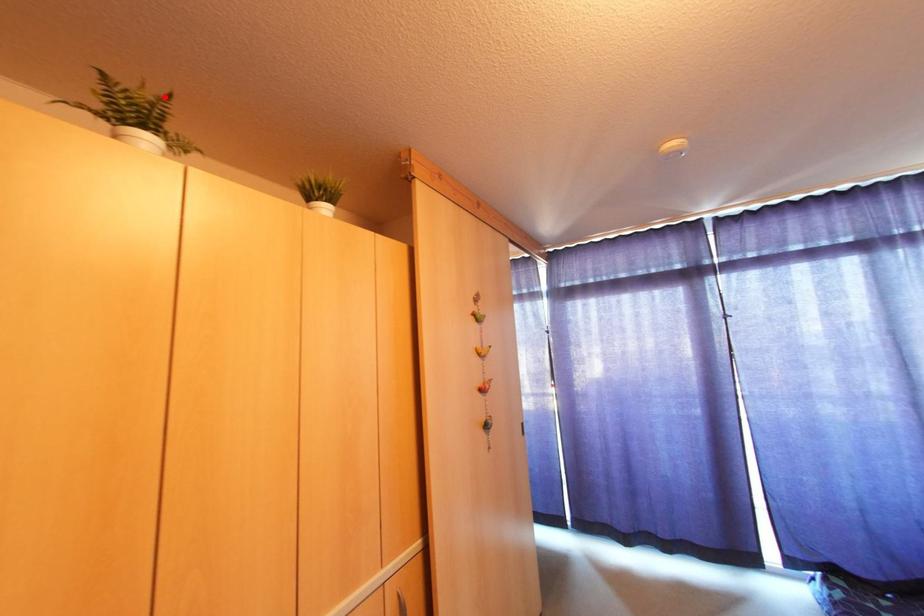
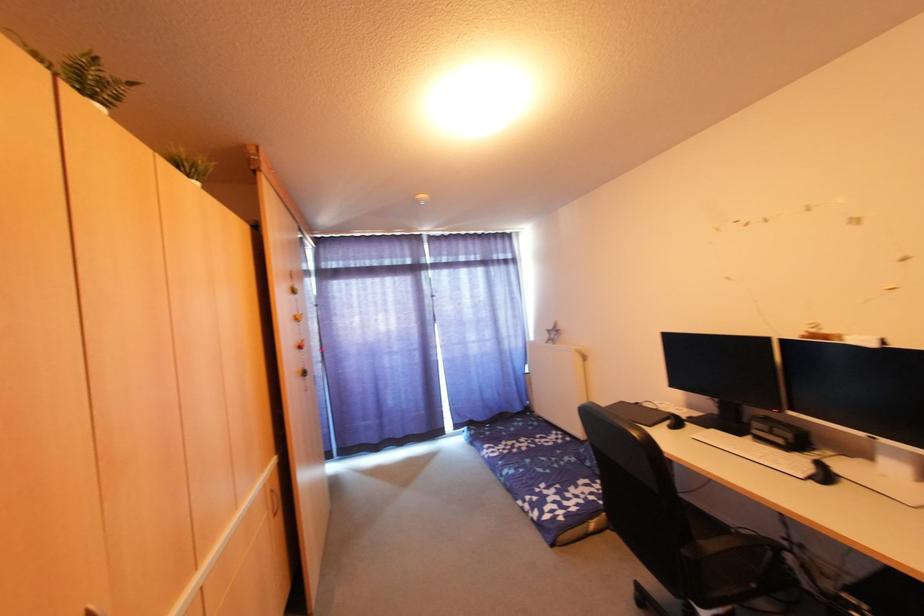
Find the pixel in the second image that matches the highlighted location in the first image.

(128, 84)